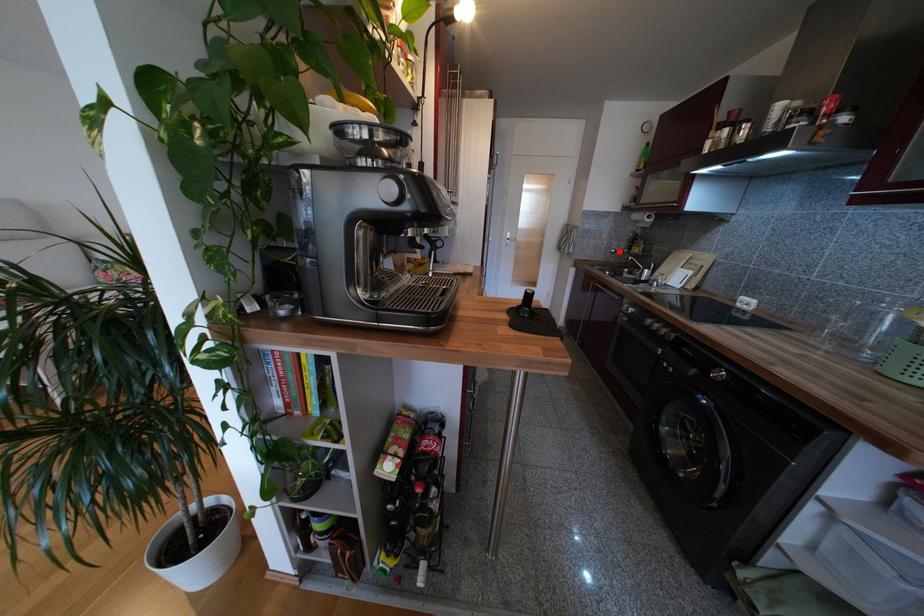
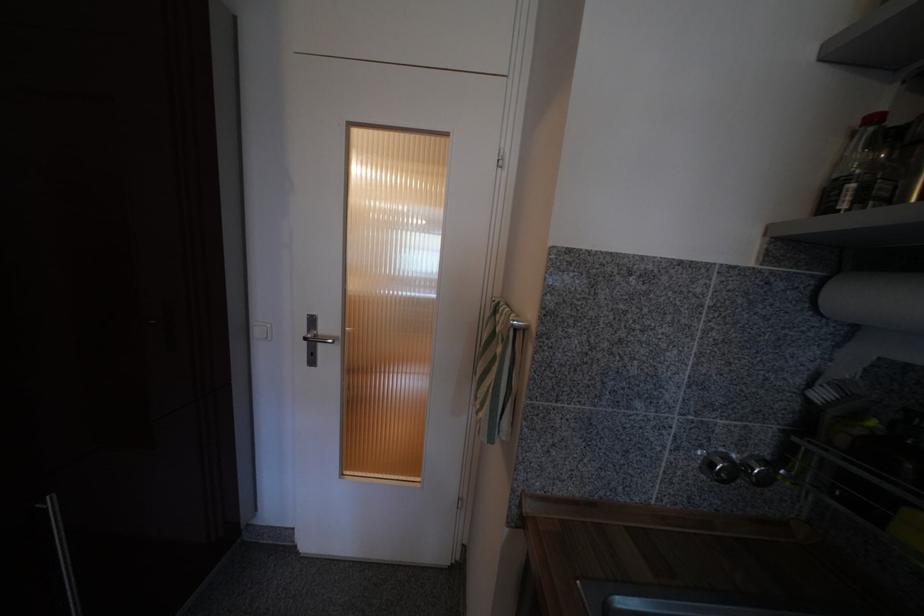
Locate, in the second image, the point that corresponds to the highlighted location in the first image.

(730, 460)